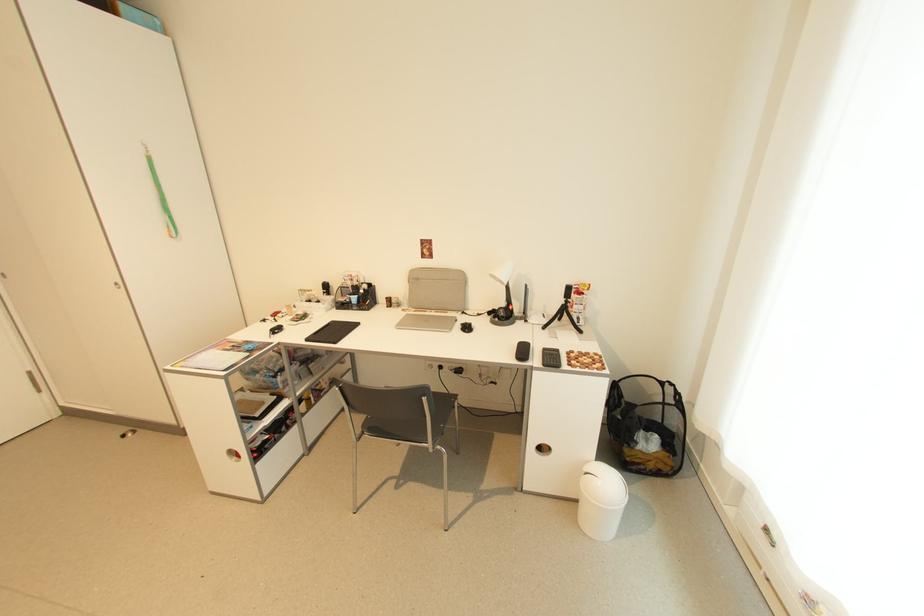
Where would you sit the chair sitting surface? Please return your answer as a coordinate pair (x, y).

(441, 408)